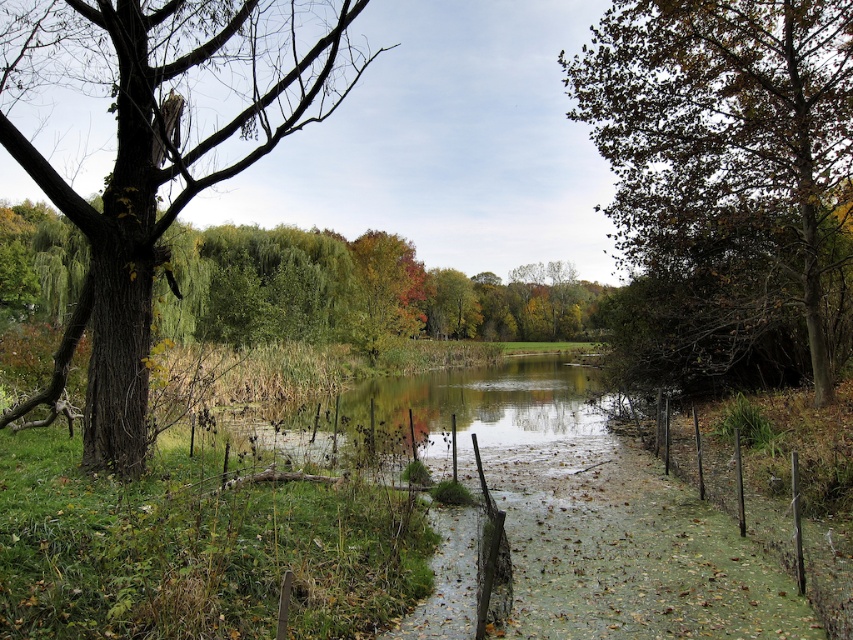
Who is more forward, (666, 227) or (322, 248)?

Point (666, 227)

Is brown leafy tree at right taller than green leafy tree at center?

Yes, brown leafy tree at right is taller than green leafy tree at center.

Identify the location of brown leafy tree at right. The width and height of the screenshot is (853, 640). (724, 129).

Who is higher up, brown rough bark tree at left or brown leafy tree at right?

brown rough bark tree at left is higher up.

Can you confirm if brown rough bark tree at left is wider than brown leafy tree at right?

Yes, brown rough bark tree at left is wider than brown leafy tree at right.

Is point (194, 141) in front of point (656, 260)?

Yes.

Where is `brown rough bark tree at left`? brown rough bark tree at left is located at coordinates (160, 150).

Is brown rough bark tree at left in front of green leafy tree at center?

That is True.

Which is more to the left, brown rough bark tree at left or green leafy tree at center?

From the viewer's perspective, brown rough bark tree at left appears more on the left side.

Image resolution: width=853 pixels, height=640 pixels. What do you see at coordinates (160, 150) in the screenshot?
I see `brown rough bark tree at left` at bounding box center [160, 150].

I want to click on brown rough bark tree at left, so pos(160,150).